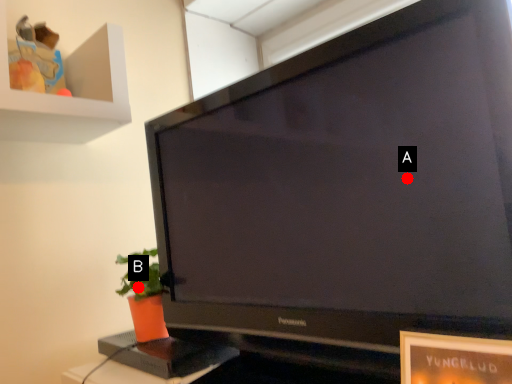
Question: Two points are circled on the image, labeled by A and B beside each circle. Which point is closer to the camera?

Choices:
 (A) A is closer
 (B) B is closer

Answer: (A)